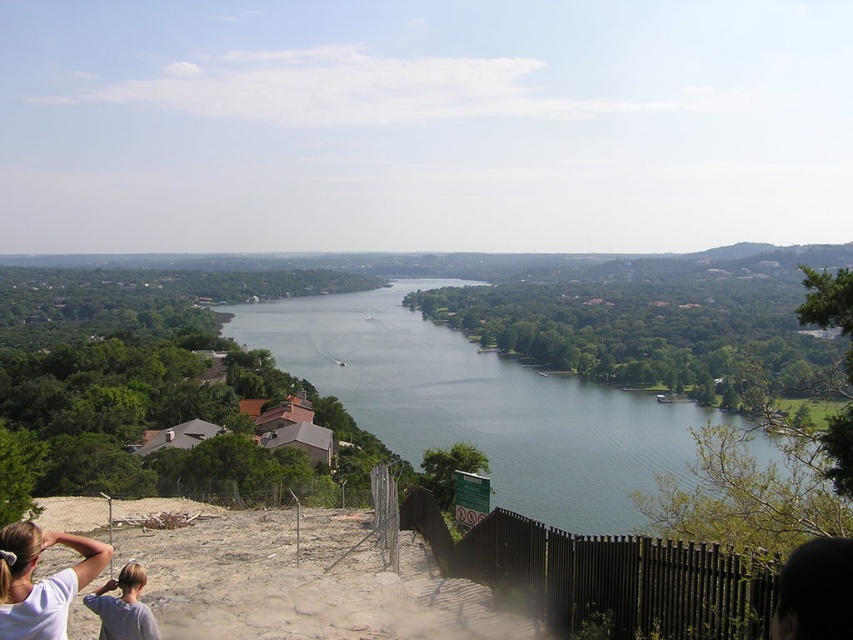
You are standing at the point labeled as point (x=485, y=404) in the image. Based on the scene description, what type of surface are you currently standing on?

The point (x=485, y=404) is on green water at center, so you are standing on water.

You are standing at the top of the dirt path and want to take a photo of the green water at center without the white matte shirt at lower left appearing in the frame. Is it possible to do so by adjusting your camera angle?

Yes, since the green water at center is below the white matte shirt at lower left, you can lower your camera angle to capture the green water at center while avoiding the white matte shirt at lower left in the frame.